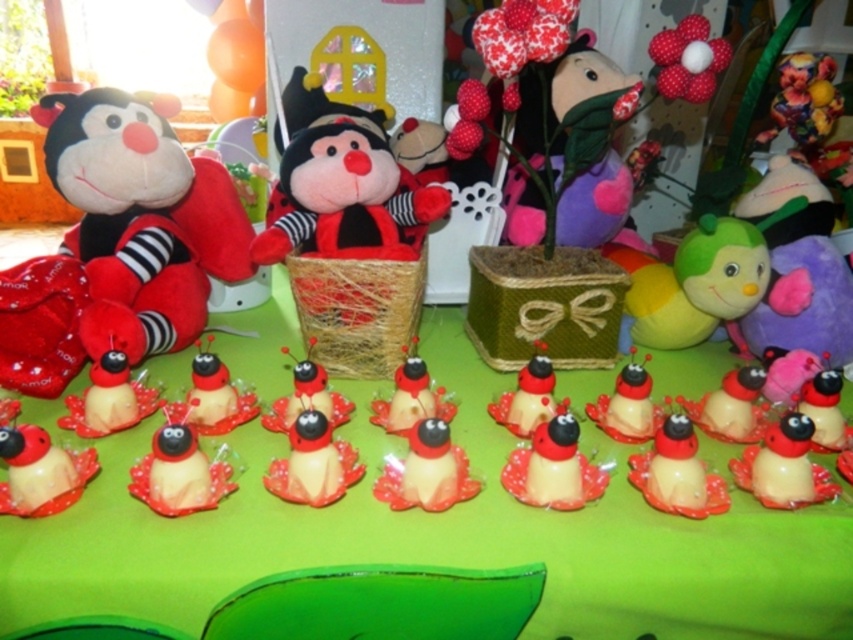
Question: Which point appears closest to the camera in this image?

Choices:
 (A) (552, 515)
 (B) (283, 163)

Answer: (A)

Question: Is green matte table at center positioned at the back of plush toy at center?

Choices:
 (A) yes
 (B) no

Answer: (B)

Question: Which of the following is the closest to the observer?

Choices:
 (A) [x=51, y=609]
 (B) [x=378, y=244]

Answer: (A)

Question: Is green matte table at center wider than soft plush toy at left?

Choices:
 (A) no
 (B) yes

Answer: (B)

Question: Is soft plush toy at left behind plush toy at center?

Choices:
 (A) yes
 (B) no

Answer: (B)

Question: Considering the real-world distances, which object is closest to the soft plush toy at left?

Choices:
 (A) green matte table at center
 (B) plush toy at center

Answer: (B)